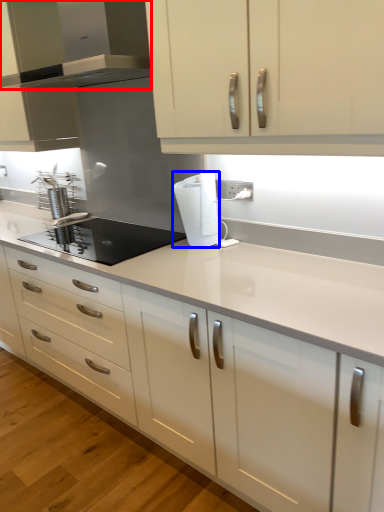
Question: Which of the following is the farthest to the observer, home appliance (highlighted by a red box) or paper towel (highlighted by a blue box)?

Choices:
 (A) home appliance
 (B) paper towel

Answer: (B)